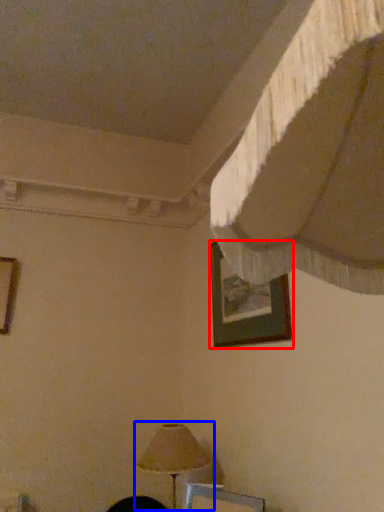
Question: Which object is closer to the camera taking this photo, picture frame (highlighted by a red box) or lamp (highlighted by a blue box)?

Choices:
 (A) picture frame
 (B) lamp

Answer: (A)